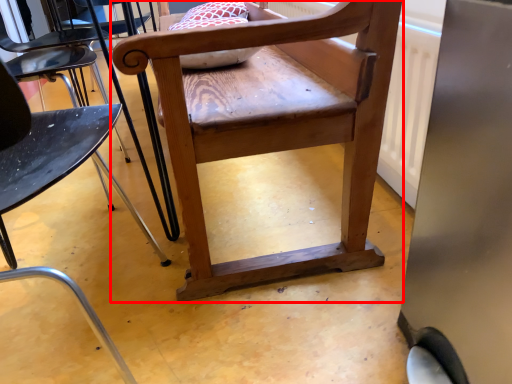
Question: From the image, what is the correct spatial relationship of chair (annotated by the red box) in relation to chair?

Choices:
 (A) right
 (B) left

Answer: (A)